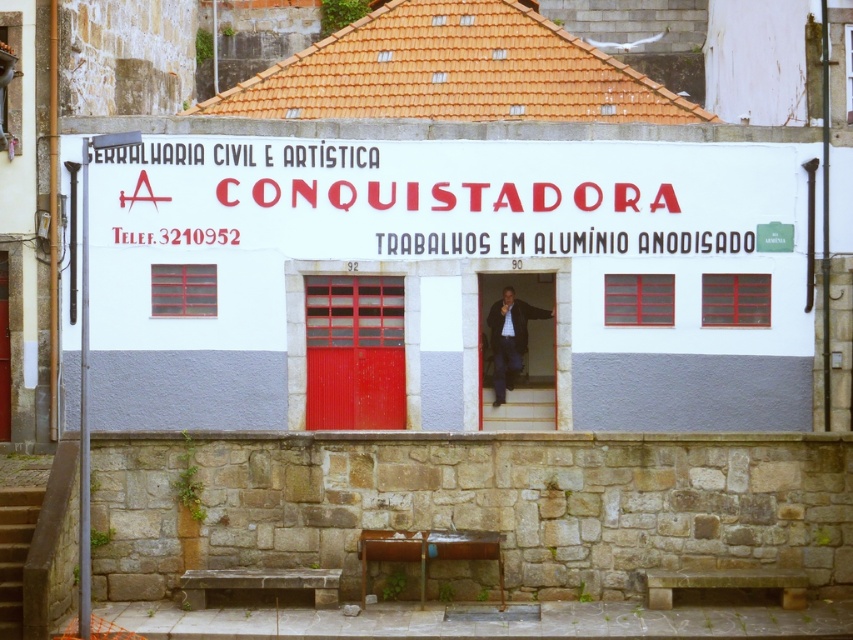
You are standing in front of the building described in the scene. You notice a specific point marked at coordinates (447, 278). What is located at this point?

The point at coordinates (447, 278) is where the white painted wall at center is located.

You are standing in front of the building and want to locate the two points mentioned. According to their positions, which point is closer to you, point (103, 166) or point (376, 403)?

Point (103, 166) is in front of point (376, 403), so it is closer to you.